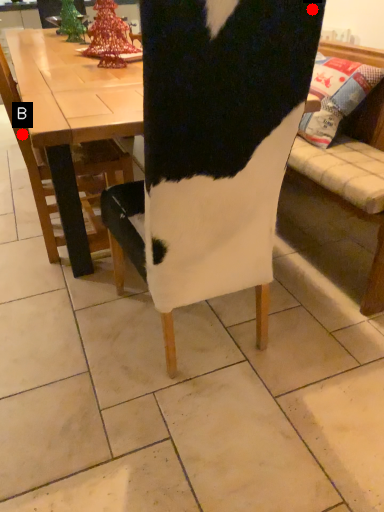
Question: Two points are circled on the image, labeled by A and B beside each circle. Which of the following is the farthest from the observer?

Choices:
 (A) A is further
 (B) B is further

Answer: (B)